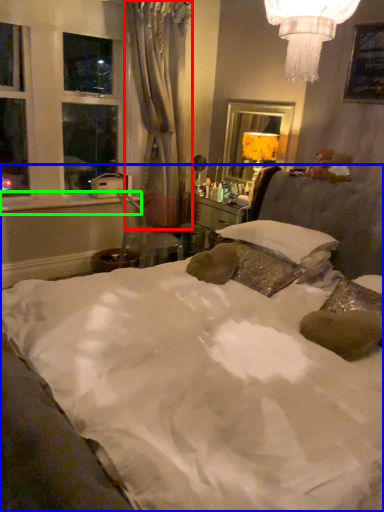
Question: Which object is positioned farthest from curtain (highlighted by a red box)? Select from bed (highlighted by a blue box) and window sill (highlighted by a green box).

Choices:
 (A) bed
 (B) window sill

Answer: (A)